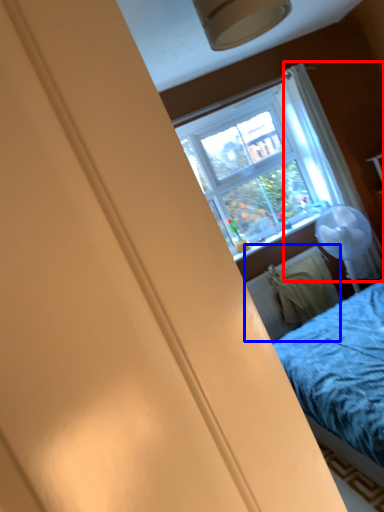
Question: Among these objects, which one is farthest to the camera, curtain (highlighted by a red box) or radiator (highlighted by a blue box)?

Choices:
 (A) curtain
 (B) radiator

Answer: (A)